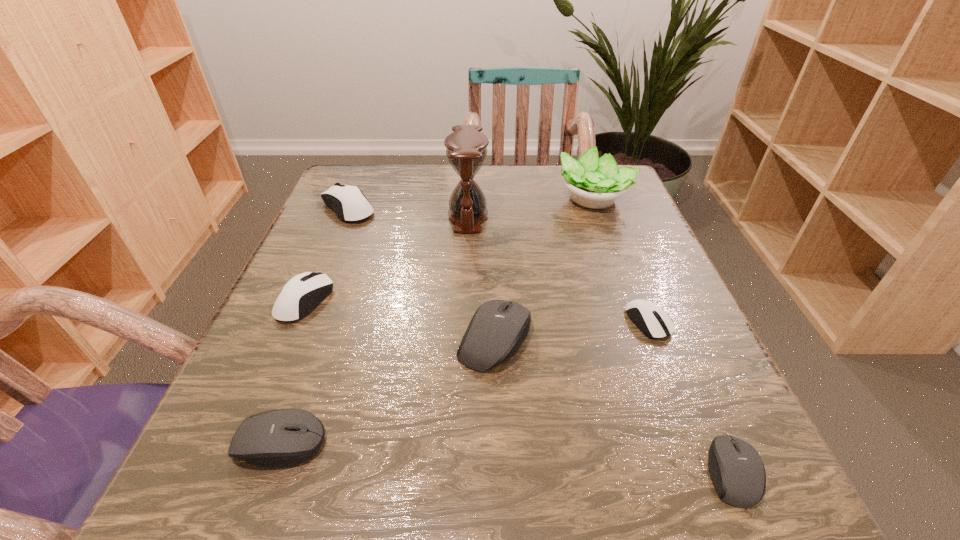
This screenshot has height=540, width=960. In order to click on vacant region at the left edge of the desktop in this screenshot , I will do `click(306, 354)`.

At what (x,y) coordinates should I click in order to perform the action: click on vacant space at the right edge of the desktop. Please return your answer as a coordinate pair (x, y). Looking at the image, I should click on (622, 263).

In the image, there is a desktop. Where is `free space at the far left corner`? This screenshot has width=960, height=540. free space at the far left corner is located at coordinates (376, 213).

This screenshot has width=960, height=540. What are the coordinates of `vacant space at the near left corner` in the screenshot? It's located at (197, 480).

You are a GUI agent. You are given a task and a screenshot of the screen. Output one action in this format:
    pyautogui.click(x=<x>, y=<y>)
    Task: Click on the vacant space at the near right corner
    The image size is (960, 540).
    Given the screenshot: What is the action you would take?
    pyautogui.click(x=644, y=484)

Find the location of a particular element. Image resolution: width=960 pixels, height=540 pixels. empty location between the brown hourglass and the farthest computer equipment is located at coordinates (408, 212).

The height and width of the screenshot is (540, 960). I want to click on vacant area that lies between the lettuce and the hourglass, so click(531, 207).

Where is `empty location between the biggest white mouse and the leftmost black computer equipment`? Image resolution: width=960 pixels, height=540 pixels. empty location between the biggest white mouse and the leftmost black computer equipment is located at coordinates (314, 325).

The height and width of the screenshot is (540, 960). I want to click on vacant space in between the rightmost white mouse and the smallest black computer equipment, so click(x=690, y=397).

This screenshot has height=540, width=960. What are the coordinates of `vacant area between the second tallest object and the second biggest white mouse` in the screenshot? It's located at (449, 249).